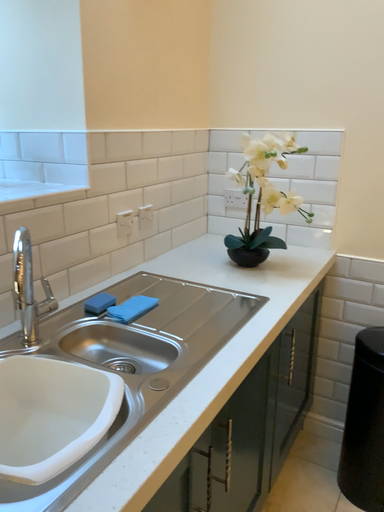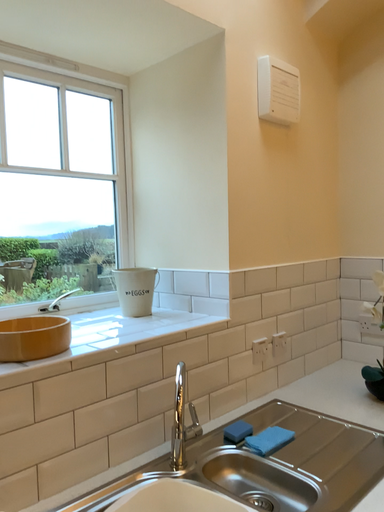
Question: Which way did the camera rotate in the video?

Choices:
 (A) rotated right
 (B) rotated left

Answer: (B)